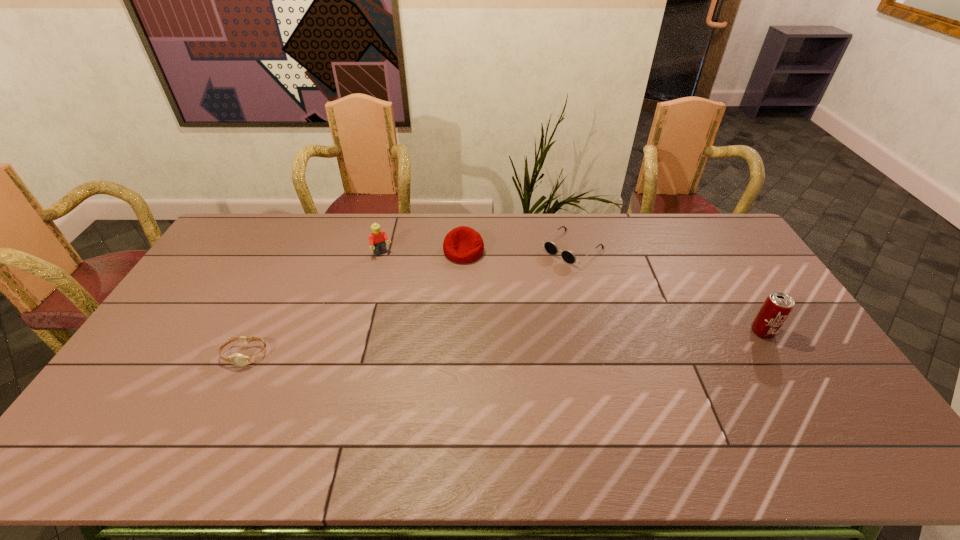
Locate an element on the screen. sunglasses present at the far edge is located at coordinates (568, 256).

The width and height of the screenshot is (960, 540). I want to click on Lego at the far edge, so (x=377, y=238).

The width and height of the screenshot is (960, 540). In order to click on object that is at the right edge in this screenshot , I will do click(x=777, y=307).

The width and height of the screenshot is (960, 540). In order to click on free point at the far edge in this screenshot , I will do `click(488, 214)`.

Where is `vacant space at the near edge of the desktop`? Image resolution: width=960 pixels, height=540 pixels. vacant space at the near edge of the desktop is located at coordinates (303, 404).

At what (x,y) coordinates should I click in order to perform the action: click on vacant position at the left edge of the desktop. Please return your answer as a coordinate pair (x, y). This screenshot has width=960, height=540. Looking at the image, I should click on (198, 281).

Where is `blank space at the right edge of the desktop`? blank space at the right edge of the desktop is located at coordinates (755, 313).

In order to click on free spot at the near left corner of the desktop in this screenshot , I will do `click(120, 420)`.

You are a GUI agent. You are given a task and a screenshot of the screen. Output one action in this format:
    pyautogui.click(x=<x>, y=<y>)
    Task: Click on the vacant space at the far right corner
    This screenshot has height=540, width=960.
    Given the screenshot: What is the action you would take?
    pyautogui.click(x=706, y=216)

The image size is (960, 540). What are the coordinates of `free area in between the sunglasses and the fourth farthest object` in the screenshot? It's located at coord(667,290).